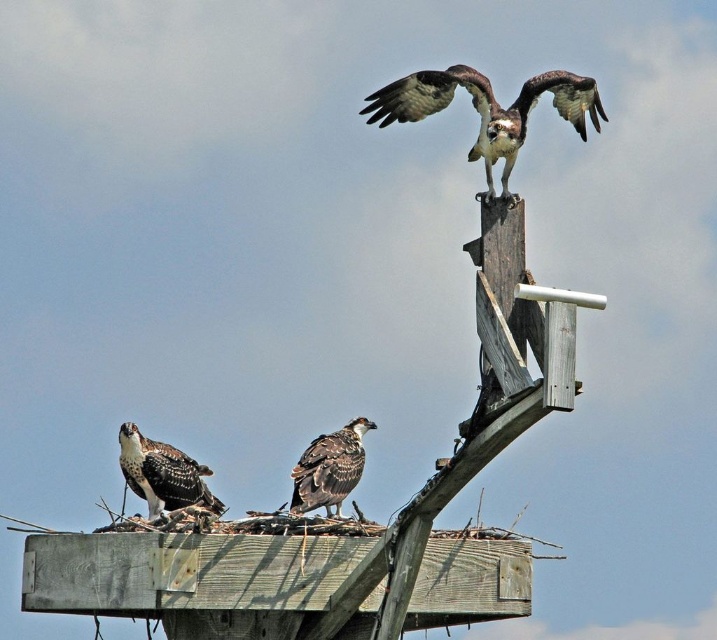
In the scene shown: Does brown speckled feathers at lower left have a smaller size compared to dark brown feathers at center?

Incorrect, brown speckled feathers at lower left is not smaller in size than dark brown feathers at center.

The height and width of the screenshot is (640, 717). Describe the element at coordinates (163, 474) in the screenshot. I see `brown speckled feathers at lower left` at that location.

I want to click on brown speckled feathers at lower left, so click(x=163, y=474).

Who is more distant from viewer, (490, 163) or (337, 468)?

Positioned behind is point (337, 468).

You are a GUI agent. You are given a task and a screenshot of the screen. Output one action in this format:
    pyautogui.click(x=<x>, y=<y>)
    Task: Click on the brown speckled feathers at upper center
    The image size is (717, 640).
    Given the screenshot: What is the action you would take?
    pyautogui.click(x=488, y=109)

Between point (424, 113) and point (123, 470), which one is positioned in front?

Positioned in front is point (424, 113).

Can you confirm if brown speckled feathers at upper center is positioned to the left of brown speckled feathers at lower left?

No, brown speckled feathers at upper center is not to the left of brown speckled feathers at lower left.

Does point (417, 102) lie behind point (130, 454)?

That is False.

Where is `brown speckled feathers at upper center`? brown speckled feathers at upper center is located at coordinates (488, 109).